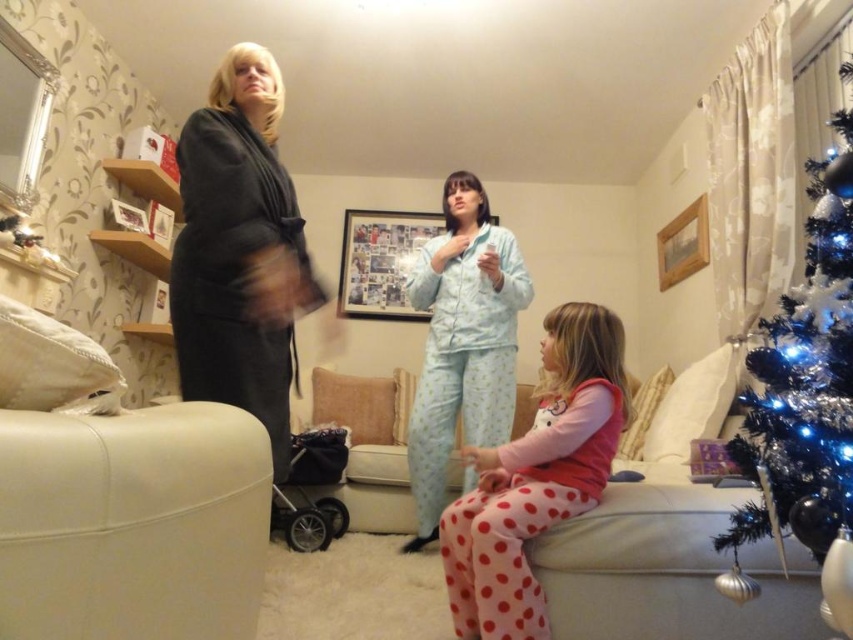
Question: Is white leather armchair at lower left closer to the viewer compared to light blue cotton pajamas at center?

Choices:
 (A) no
 (B) yes

Answer: (B)

Question: Considering the real-world distances, which object is farthest from the white leather armchair at lower left?

Choices:
 (A) shiny metallic tree at right
 (B) dark gray robe at left

Answer: (A)

Question: Considering the real-world distances, which object is farthest from the dark gray robe at left?

Choices:
 (A) pink polka dot pajamas at lower center
 (B) light blue cotton pajamas at center

Answer: (B)

Question: Is shiny metallic tree at right to the right of light blue cotton pajamas at center from the viewer's perspective?

Choices:
 (A) yes
 (B) no

Answer: (A)

Question: Which object appears farthest from the camera in this image?

Choices:
 (A) white leather armchair at lower left
 (B) pink polka dot pajamas at lower center

Answer: (B)

Question: Does white leather armchair at lower left have a smaller size compared to light blue cotton pajamas at center?

Choices:
 (A) no
 (B) yes

Answer: (B)